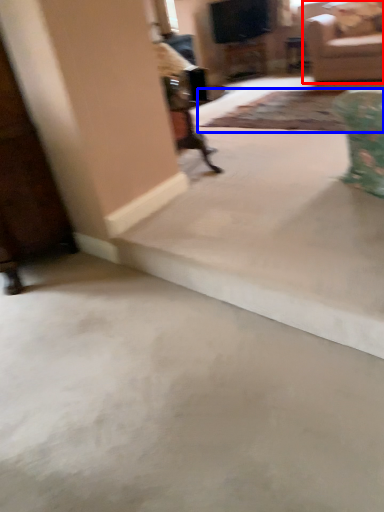
Question: Among these objects, which one is farthest to the camera, studio couch (highlighted by a red box) or mat (highlighted by a blue box)?

Choices:
 (A) studio couch
 (B) mat

Answer: (A)